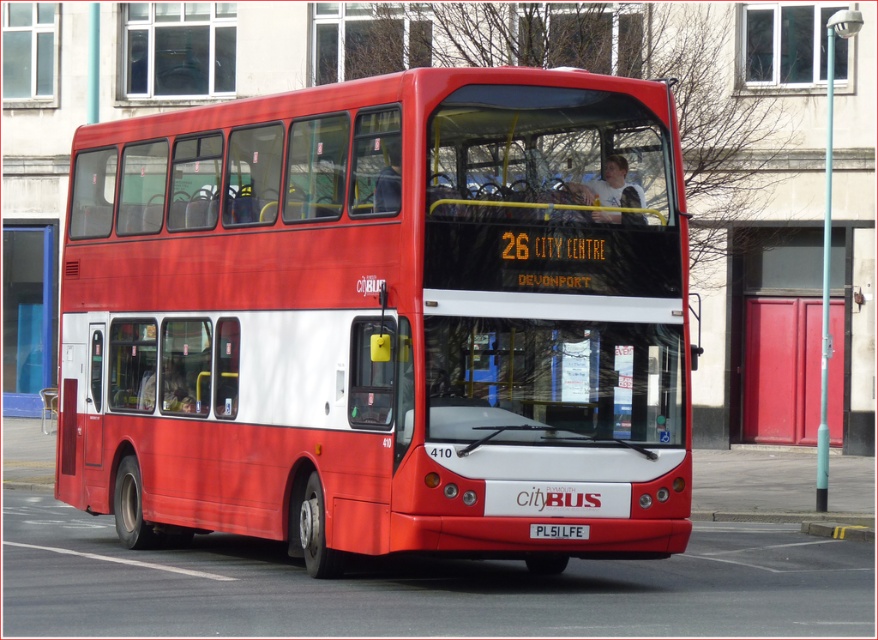
You are a photographer trying to capture a clear shot of the white plastic license plate at center while also including the matte red bus at center in the frame. Given that the license plate is small, will you need to adjust your camera focus to ensure both are in focus?

The matte red bus at center is larger in size than the white plastic license plate at center, so you can keep the focus on the bus and still have the license plate in focus without needing major adjustments.

You are standing at the camera position and want to cross the street safely. The matte red bus at center is approaching you. If the bus is moving at a constant speed of 15 mph, how many seconds do you have before the bus reaches your current position?

The matte red bus at center is 39.85 feet away from you. At 15 mph, the bus travels 22 feet per second. Dividing 39.85 by 22 gives approximately 1.81 seconds. Therefore, you have about 1.81 seconds before the bus reaches your position.